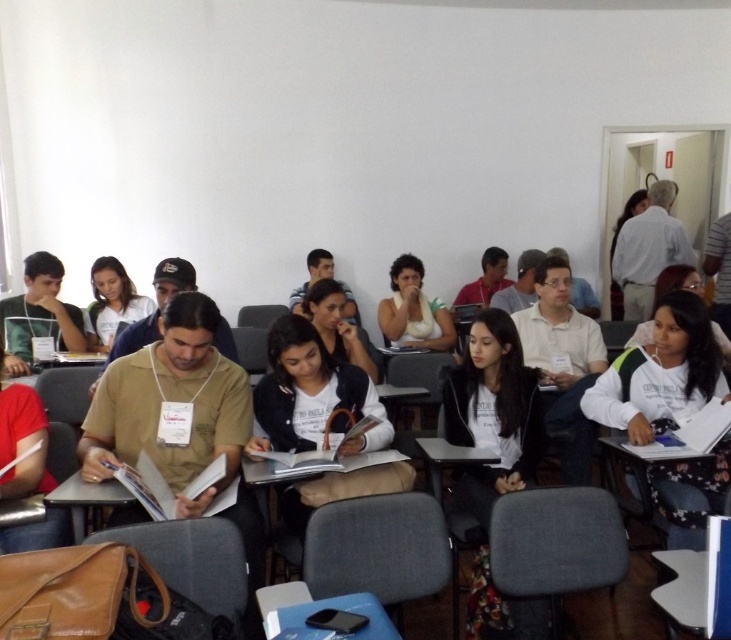
Question: Which object appears closest to the camera in this image?

Choices:
 (A) white plastic table at lower right
 (B) white cotton shirt at lower right

Answer: (A)

Question: Can you confirm if white plastic table at lower right is positioned to the right of white plastic table at lower center?

Choices:
 (A) yes
 (B) no

Answer: (A)

Question: Is the position of white cotton shirt at lower right less distant than that of white plastic table at lower right?

Choices:
 (A) yes
 (B) no

Answer: (B)

Question: Which object appears farthest from the camera in this image?

Choices:
 (A) white cotton shirt at lower right
 (B) white plastic table at lower right

Answer: (A)

Question: Can you confirm if white cotton shirt at lower right is bigger than white plastic table at lower right?

Choices:
 (A) yes
 (B) no

Answer: (A)

Question: Which object is farther from the camera taking this photo?

Choices:
 (A) white cotton shirt at lower right
 (B) white plastic table at lower center
 (C) white plastic table at lower right

Answer: (A)